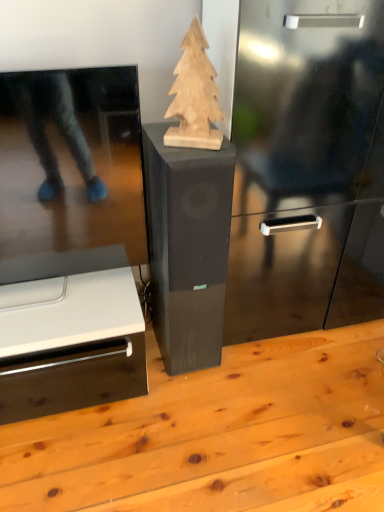
The width and height of the screenshot is (384, 512). I want to click on free space in front of natural wood christmas tree at center, so click(192, 154).